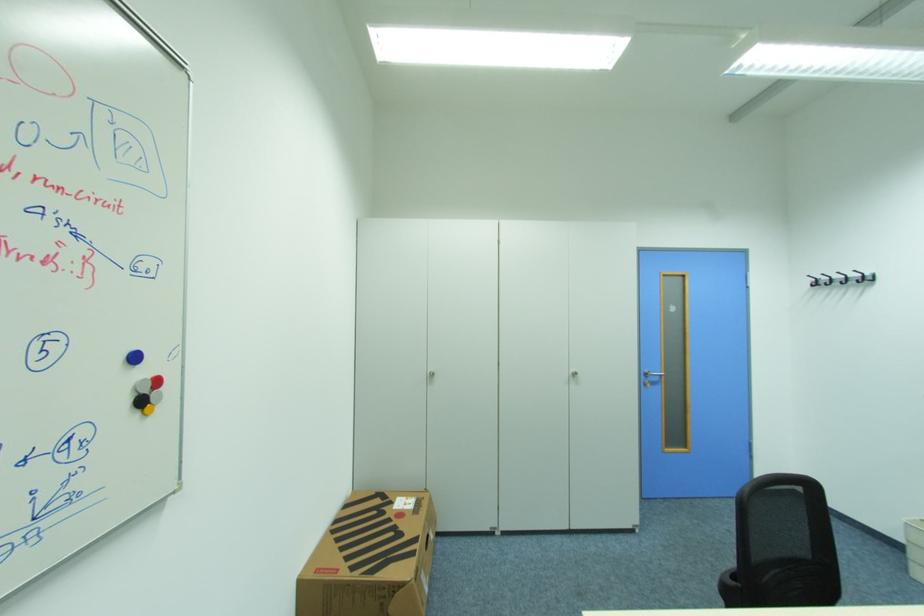
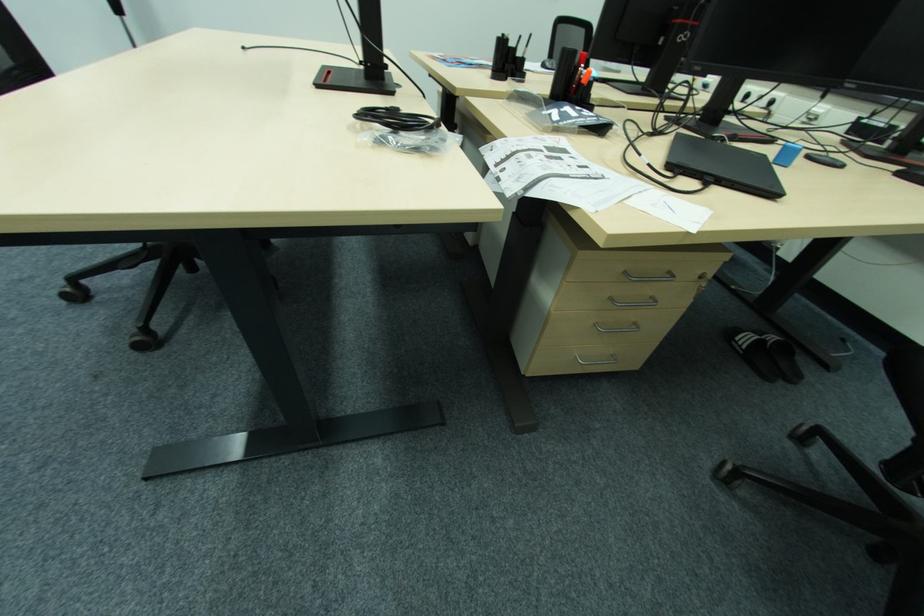
The images are taken continuously from a first-person perspective. In which direction is your viewpoint rotating?

The camera rotated toward right-down.